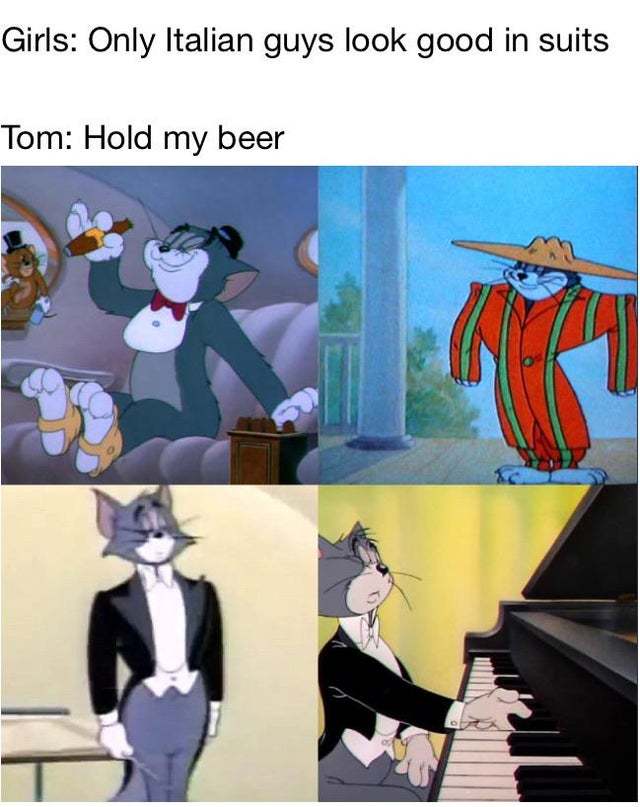
Locate an element on the screen. The height and width of the screenshot is (807, 640). piano is located at coordinates (571, 693).